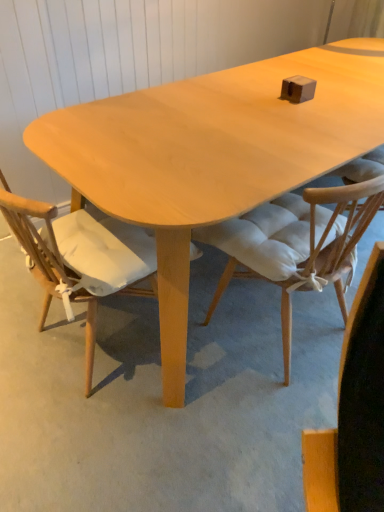
Where is `vacant area situated below white padded chair at center, which appears as the 1th chair when viewed from the right (from a real-world perspective)`? This screenshot has width=384, height=512. vacant area situated below white padded chair at center, which appears as the 1th chair when viewed from the right (from a real-world perspective) is located at coordinates (269, 322).